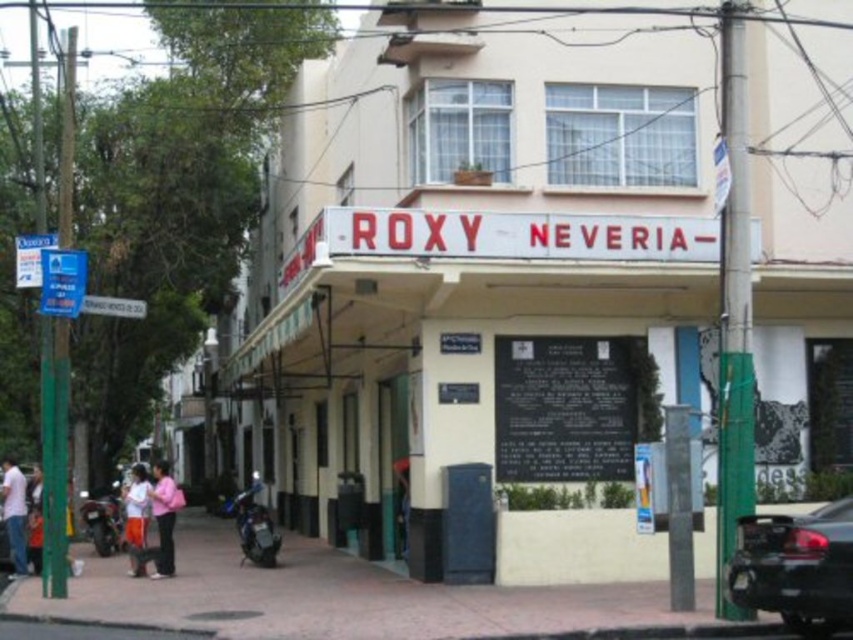
Is point (257, 532) farther from viewer compared to point (3, 465)?

No.

Looking at this image, between shiny metallic motorcycle at lower left and light blue jeans at lower left, which one appears on the right side from the viewer's perspective?

Positioned to the right is shiny metallic motorcycle at lower left.

Who is more forward, (265,529) or (20,568)?

Point (20,568)

Where is `shiny metallic motorcycle at lower left`? The height and width of the screenshot is (640, 853). shiny metallic motorcycle at lower left is located at coordinates (254, 525).

Describe the element at coordinates (15, 515) in the screenshot. I see `light blue jeans at lower left` at that location.

Who is lower down, light blue jeans at lower left or orange cotton pants at lower left?

Positioned lower is orange cotton pants at lower left.

Identify the location of light blue jeans at lower left. (15, 515).

In the scene shown: Who is positioned more to the right, black polished stone plaque at center or shiny black motorcycle at lower left?

black polished stone plaque at center

Does black polished stone plaque at center have a lesser height compared to shiny black motorcycle at lower left?

Incorrect, black polished stone plaque at center's height does not fall short of shiny black motorcycle at lower left's.

Who is more distant from viewer, (x=532, y=353) or (x=119, y=483)?

The point (x=119, y=483) is more distant.

The width and height of the screenshot is (853, 640). Find the location of `black polished stone plaque at center`. black polished stone plaque at center is located at coordinates (572, 406).